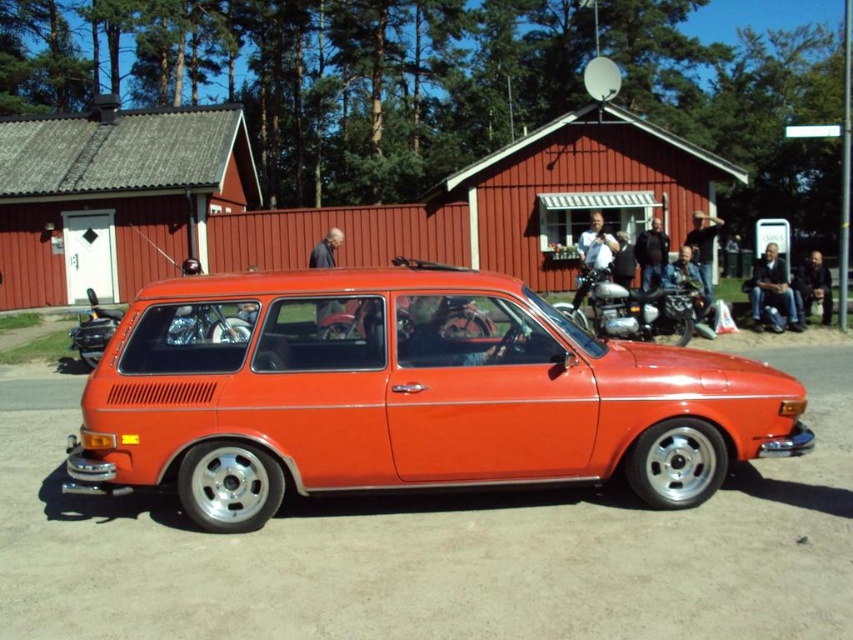
You are standing in front of the vintage station wagon and notice the shiny chrome motorcycle at center and the jeans at center. Which object is nearer to you?

The shiny chrome motorcycle at center is closer to the viewer than the jeans at center.

You are a photographer wanting to capture both the glossy orange station wagon at center and the shiny chrome motorcycle at center in a single frame. Based on their positions, which vehicle should you focus on first to ensure both are in the shot?

The glossy orange station wagon at center is located below the shiny chrome motorcycle at center, so you should focus on the motorcycle first to ensure both are in the shot.